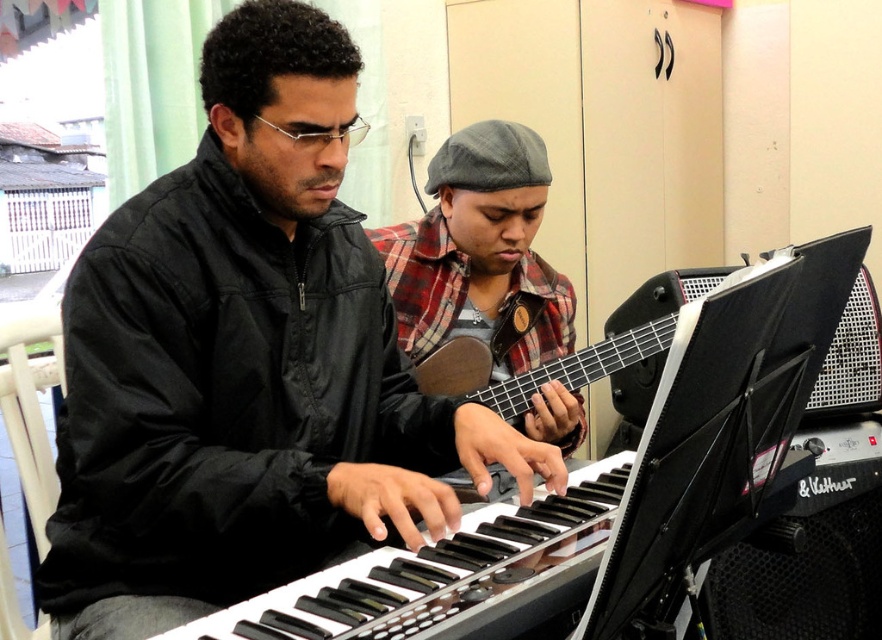
Does black glossy keyboard at center appear over plaid fabric guitar at center?

Actually, black glossy keyboard at center is below plaid fabric guitar at center.

I want to click on black glossy keyboard at center, so click(x=447, y=577).

Is point (534, 573) positioned after point (516, 140)?

No.

Where is `black glossy keyboard at center`? This screenshot has width=882, height=640. black glossy keyboard at center is located at coordinates (447, 577).

Describe the element at coordinates (247, 362) in the screenshot. This screenshot has width=882, height=640. I see `black matte jacket at center` at that location.

Can you confirm if black matte jacket at center is taller than plaid fabric guitar at center?

→ Yes, black matte jacket at center is taller than plaid fabric guitar at center.

Which is in front, point (417, 488) or point (421, 316)?

Point (417, 488)

Find the location of `black matte jacket at center`. black matte jacket at center is located at coordinates (247, 362).

This screenshot has height=640, width=882. Describe the element at coordinates (247, 362) in the screenshot. I see `black matte jacket at center` at that location.

Is point (200, 520) more distant than point (492, 355)?

That is False.

Who is more forward, (x=258, y=413) or (x=469, y=355)?

Point (x=258, y=413) is in front.

The image size is (882, 640). I want to click on black matte jacket at center, so click(247, 362).